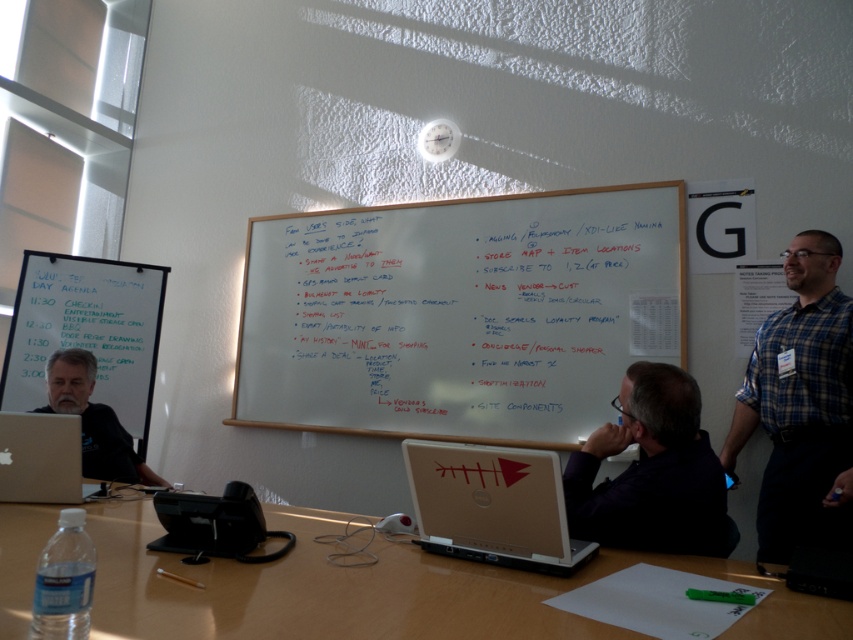
You are a volunteer at the event and need to choose a shirt to wear. You see a blue plaid shirt at right and a dark blue shirt at center. Which shirt is located to the right of the other?

The blue plaid shirt at right is positioned on the right side of dark blue shirt at center.

You need to place a large poster that requires the entire width of either the whiteboard at upper left or the matte black laptop at left. Based on the scene, which object can accommodate the poster?

The whiteboard at upper left is wider than the matte black laptop at left, so it can accommodate the poster.